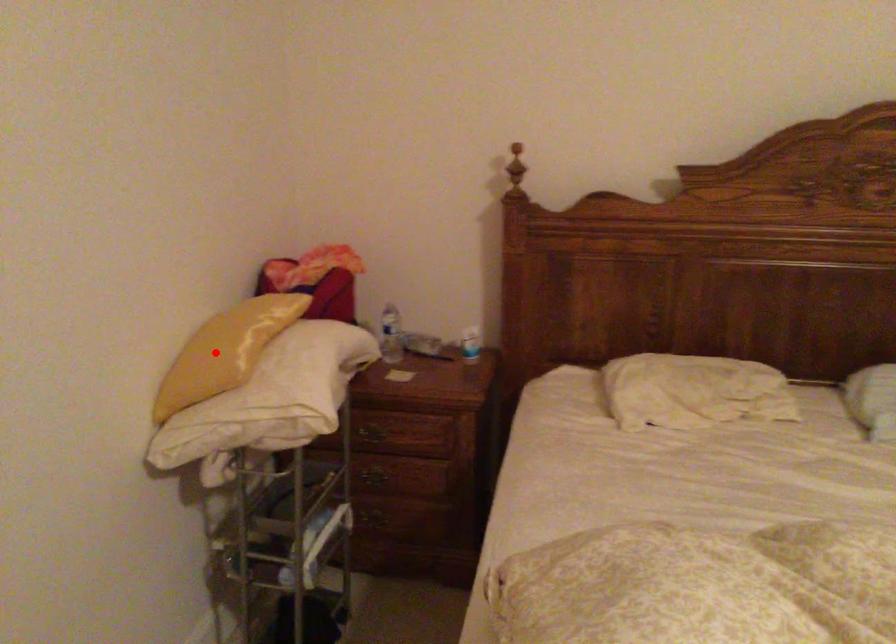
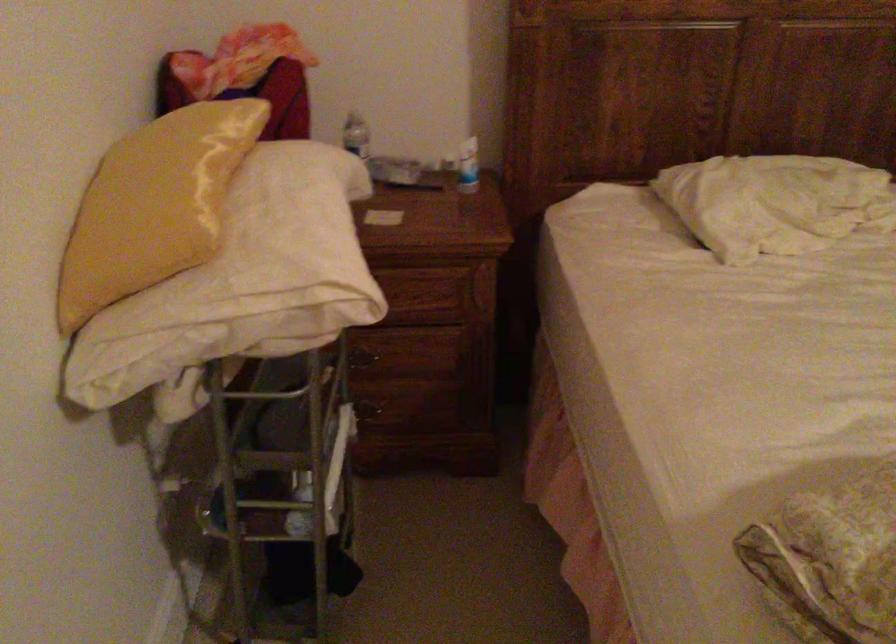
Find the pixel in the second image that matches the highlighted location in the first image.

(153, 205)